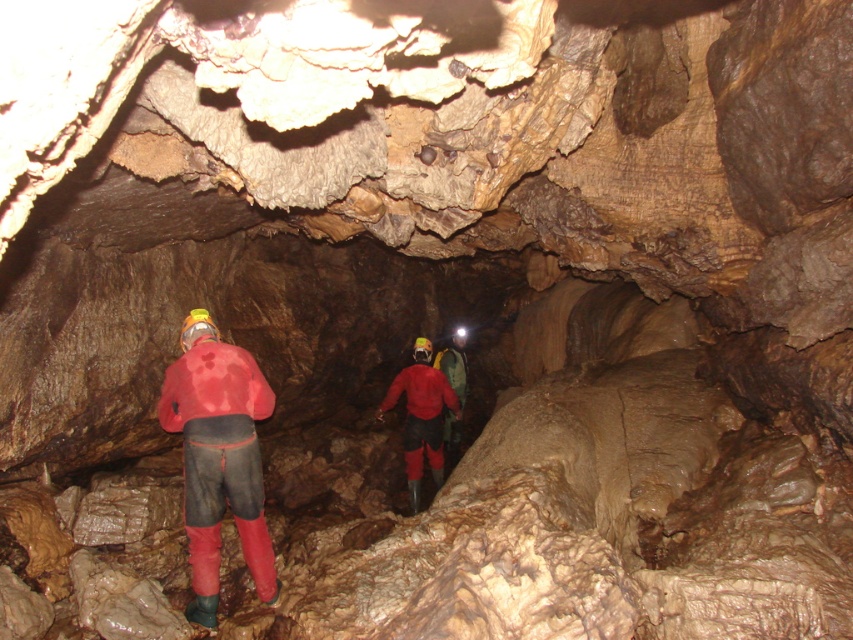
Question: Which is nearer to the rubberized red suit at center?

Choices:
 (A) red rubber boots at center
 (B) matte red jacket at center

Answer: (B)

Question: Is rubberized red suit at center below red rubber boots at center?

Choices:
 (A) yes
 (B) no

Answer: (B)

Question: Which of the following is the farthest from the observer?

Choices:
 (A) (459, 420)
 (B) (190, 468)
 (C) (426, 403)

Answer: (A)

Question: In this image, where is rubberized red suit at center located relative to matte red jacket at center?

Choices:
 (A) left
 (B) right

Answer: (A)

Question: Which of the following is the farthest from the observer?

Choices:
 (A) rubberized red suit at center
 (B) red rubber boots at center
 (C) matte red jacket at center

Answer: (B)

Question: Considering the relative positions of rubberized red suit at center and matte red jacket at center in the image provided, where is rubberized red suit at center located with respect to matte red jacket at center?

Choices:
 (A) left
 (B) right

Answer: (A)